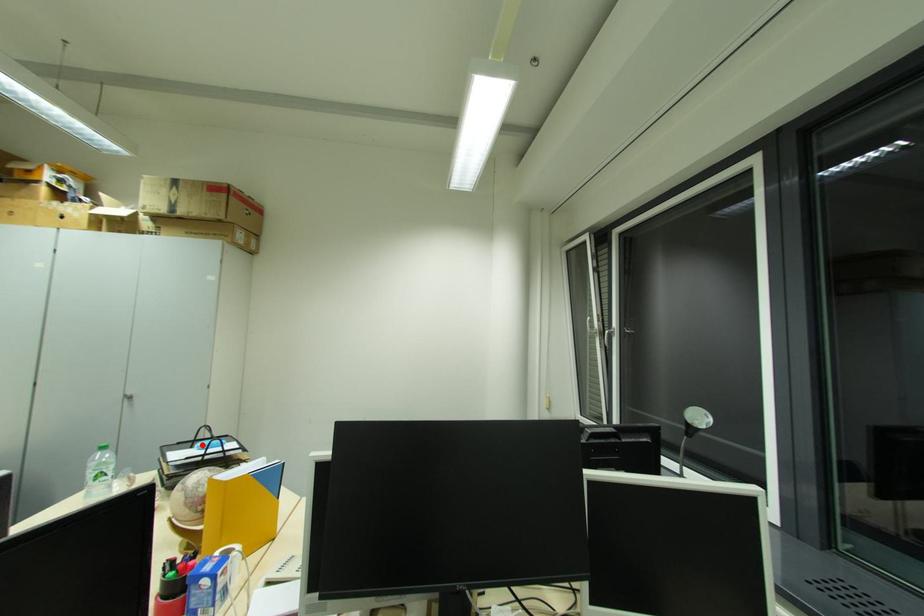
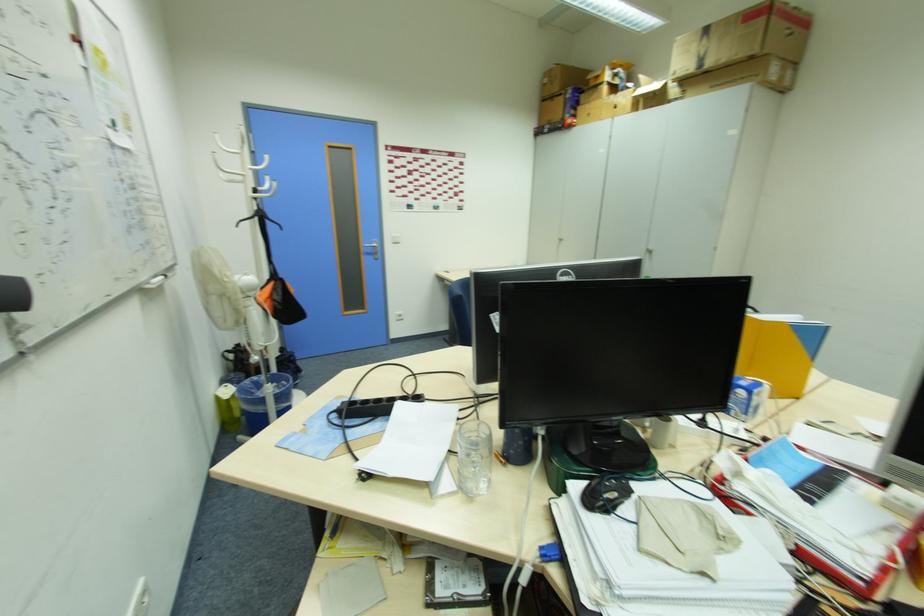
Question: I am providing you with two images of the same scene from different viewpoints. A red point is marked on the first image. Is the red point's position out of view in image 2?

Choices:
 (A) Yes
 (B) No

Answer: (A)